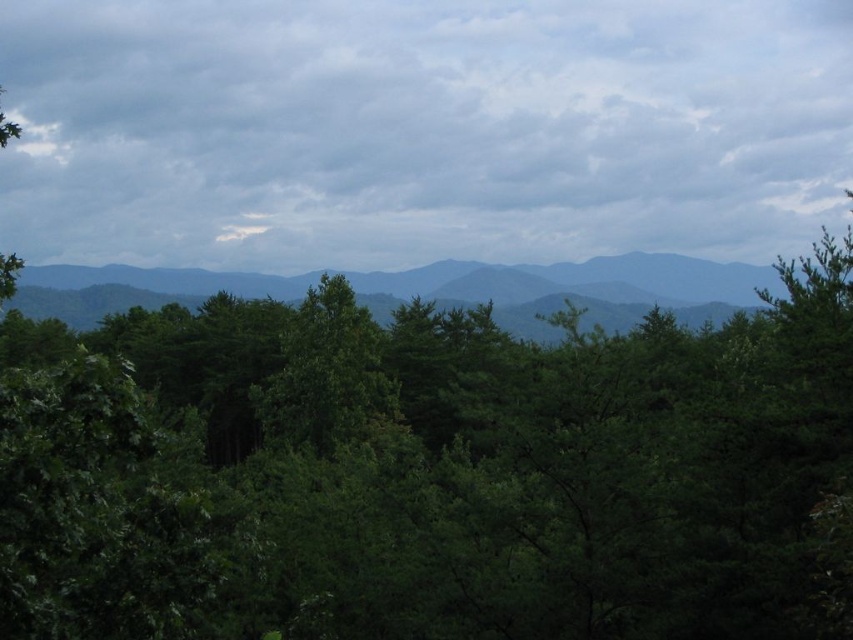
Who is higher up, cloudy sky at upper center or green leafy forest at center?

cloudy sky at upper center is above.

Is point (688, 51) behind point (97, 308)?

That is True.

Where is `cloudy sky at upper center`? The width and height of the screenshot is (853, 640). cloudy sky at upper center is located at coordinates (421, 129).

Is green leafy tree at center positioned in front of cloudy sky at upper center?

Yes, green leafy tree at center is closer to the viewer.

Does green leafy tree at center have a smaller size compared to cloudy sky at upper center?

Correct, green leafy tree at center occupies less space than cloudy sky at upper center.

This screenshot has width=853, height=640. I want to click on green leafy tree at center, so click(x=430, y=472).

Describe the element at coordinates (430, 472) in the screenshot. This screenshot has width=853, height=640. I see `green leafy tree at center` at that location.

Between green leafy tree at center and green leafy forest at center, which one has less height?

green leafy tree at center is shorter.

Where is `green leafy tree at center`? The width and height of the screenshot is (853, 640). green leafy tree at center is located at coordinates (430, 472).

This screenshot has width=853, height=640. Find the location of `green leafy tree at center`. green leafy tree at center is located at coordinates (430, 472).